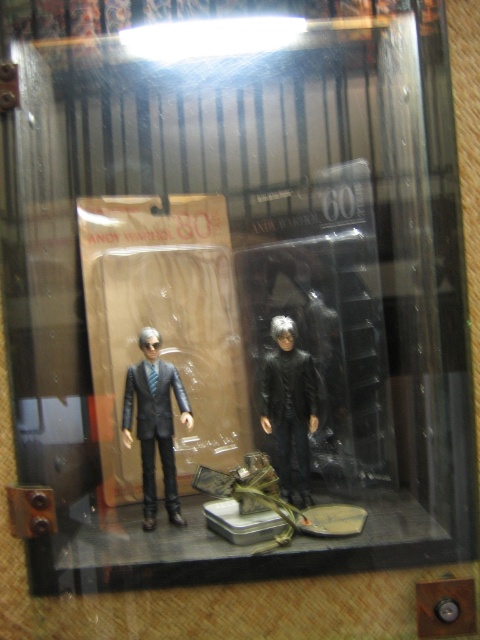
You are a collector who wants to display both the matte black suit at center and the black matte figure at center on a shelf. Given that the shelf has limited space, which of the two items should you place first to ensure both fit properly?

The matte black suit at center is larger than the black matte figure at center, so you should place the matte black suit at center first to accommodate its size, then the black matte figure at center will fit alongside it.

You are a collector looking at the display case with two Andy Warhol figures. You notice the matte black suit at center and the black matte figure at center. Which one is positioned to the left?

The matte black suit at center is positioned to the left of the black matte figure at center.